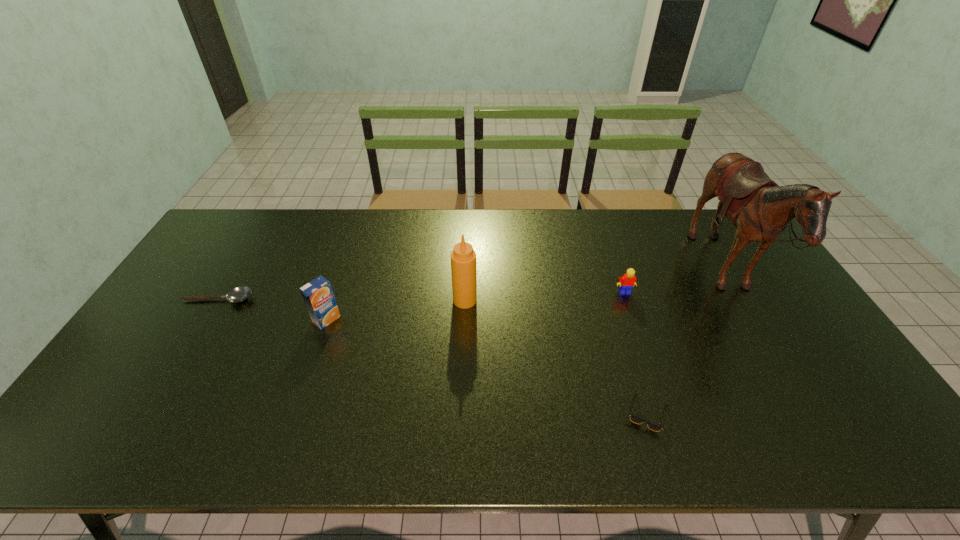
Locate an element on the screen. This screenshot has height=540, width=960. object that is at the left edge is located at coordinates (238, 294).

Locate an element on the screen. This screenshot has width=960, height=540. object located at the right edge is located at coordinates (760, 209).

This screenshot has height=540, width=960. I want to click on object at the far right corner, so click(x=760, y=209).

This screenshot has height=540, width=960. In the image, there is a desktop. What are the coordinates of `vacant region at the far edge` in the screenshot? It's located at (420, 248).

Image resolution: width=960 pixels, height=540 pixels. I want to click on blank space at the near edge of the desktop, so click(x=253, y=449).

This screenshot has height=540, width=960. Identify the location of free space at the left edge. (215, 253).

The image size is (960, 540). What are the coordinates of `vacant position at the right edge of the desktop` in the screenshot? It's located at (771, 300).

The height and width of the screenshot is (540, 960). In order to click on empty location between the orange_juice and the ladle in this screenshot , I will do `click(273, 309)`.

The image size is (960, 540). In order to click on vacant area that lies between the third tallest object and the fourth object from right to left in this screenshot , I will do `click(396, 310)`.

At what (x,y) coordinates should I click in order to perform the action: click on free space that is in between the condiment and the rightmost object. Please return your answer as a coordinate pair (x, y). Image resolution: width=960 pixels, height=540 pixels. Looking at the image, I should click on (595, 287).